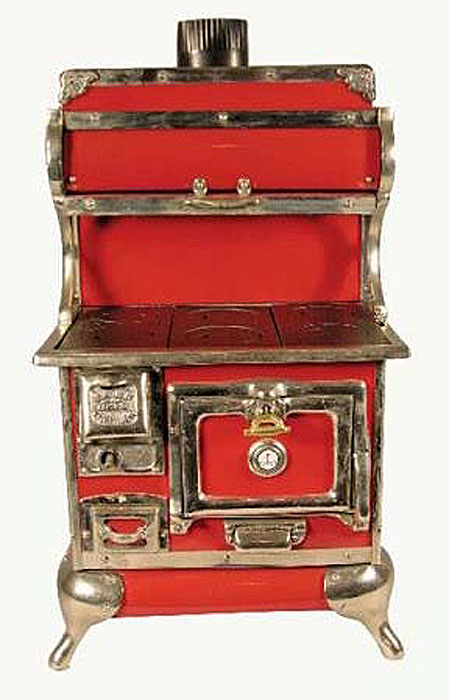
Where is `handle`? handle is located at coordinates (257, 547), (124, 537), (110, 456), (226, 203).